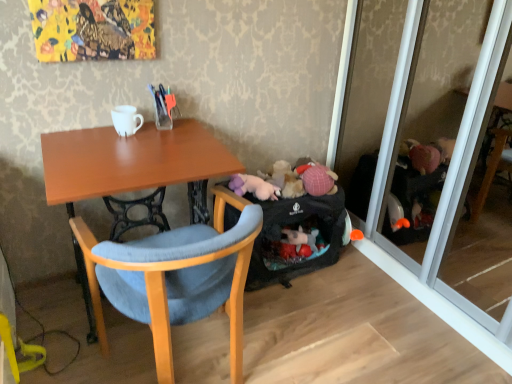
Find the location of a particular element. The height and width of the screenshot is (384, 512). vacant area located to the right-hand side of black fabric luggage at lower right is located at coordinates (365, 286).